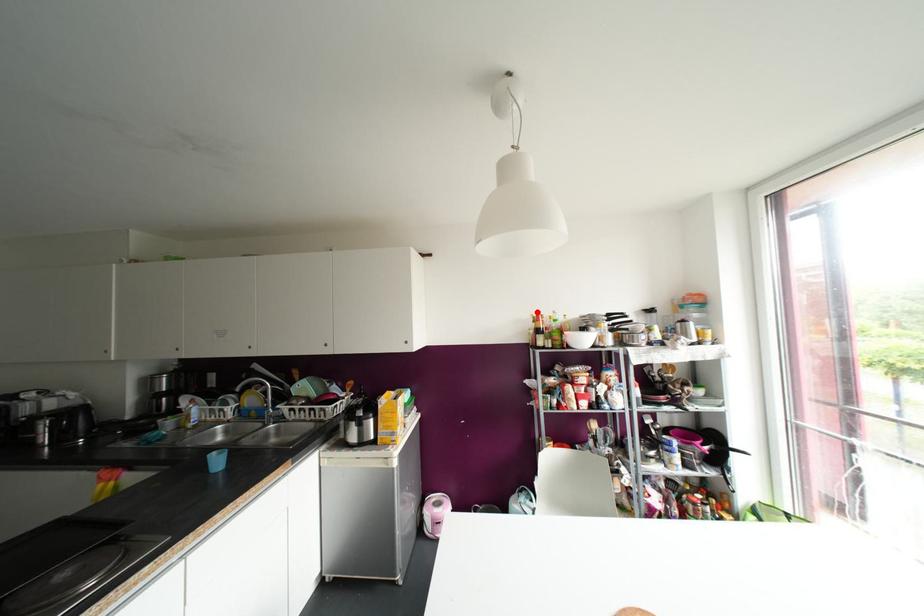
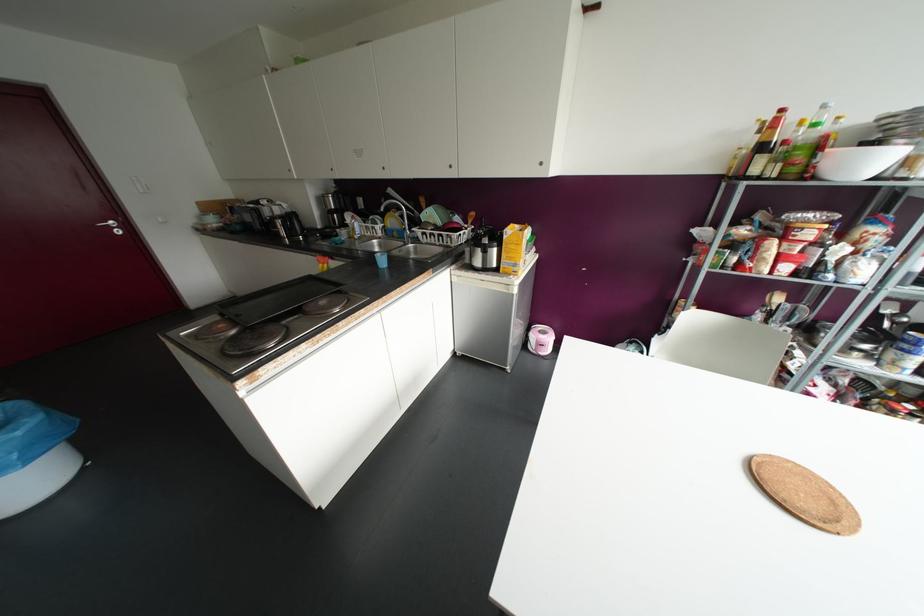
Find the pixel in the second image that matches the highlighted location in the first image.

(781, 110)